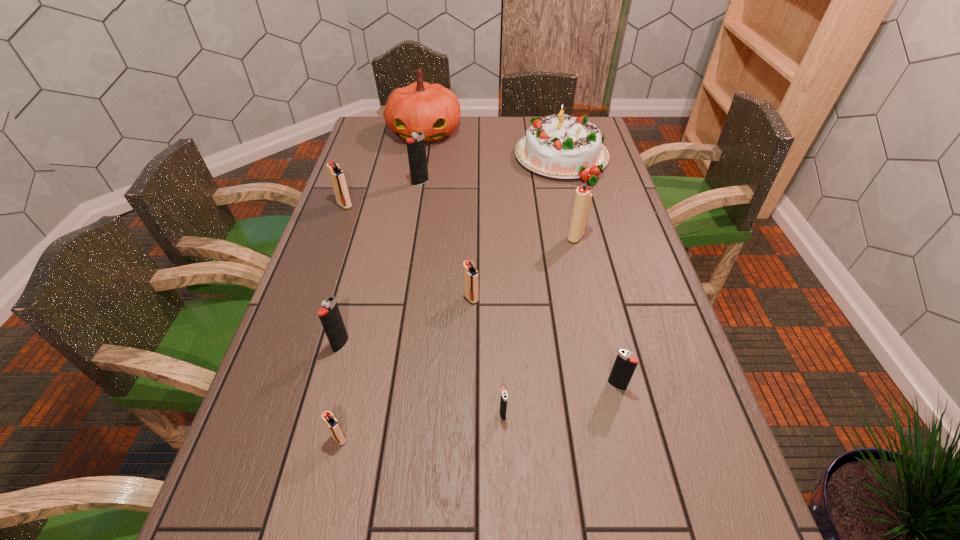
Find the location of a particular element. The image size is (960, 540). igniter that is the second closest to the fourth nearest object is located at coordinates (471, 276).

At what (x,y) coordinates should I click in order to perform the action: click on igniter that stands as the fourth closest to the second farthest igniter. Please return your answer as a coordinate pair (x, y). The height and width of the screenshot is (540, 960). Looking at the image, I should click on (583, 195).

This screenshot has height=540, width=960. Identify the location of red igniter identified as the third closest to the sixth nearest object. (331, 422).

Locate an element on the screen. This screenshot has width=960, height=540. the third closest red igniter relative to the nearest object is located at coordinates (583, 195).

Where is `the closest black igniter to the third red igniter from left to right`? the closest black igniter to the third red igniter from left to right is located at coordinates (504, 394).

Identify which black igniter is the second closest to the pumpkin. Please provide its 2D coordinates. Your answer should be formatted as a tuple, i.e. [(x, y)], where the tuple contains the x and y coordinates of a point satisfying the conditions above.

[(330, 317)]

Find the location of a particular element. Image resolution: width=960 pixels, height=540 pixels. vacant position in the image that satisfies the following two spatial constraints: 1. on the front-facing side of the tallest object; 2. on the left side of the cake is located at coordinates (420, 158).